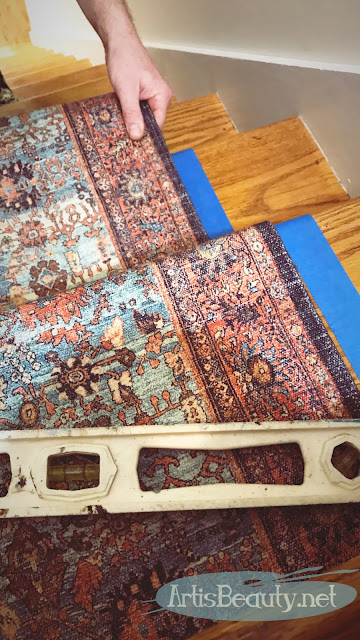
The height and width of the screenshot is (640, 360). I want to click on rug, so click(99, 349).